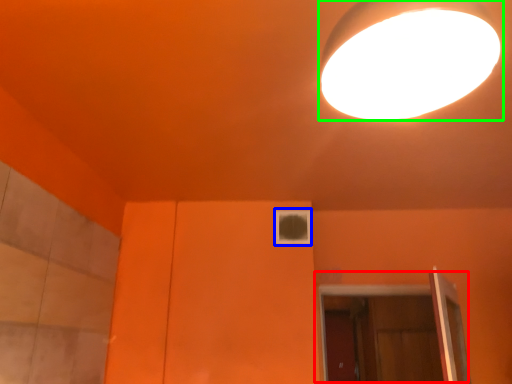
Question: Which object is positioned farthest from door (highlighted by a red box)? Select from window (highlighted by a blue box) and lamp (highlighted by a green box).

Choices:
 (A) window
 (B) lamp

Answer: (B)